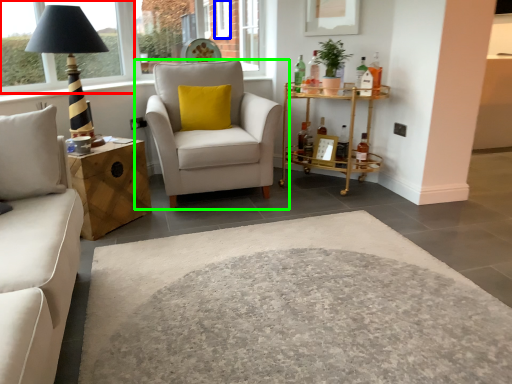
Question: Which object is positioned farthest from window frame (highlighted by a red box)? Select from window (highlighted by a blue box) and chair (highlighted by a green box).

Choices:
 (A) window
 (B) chair

Answer: (A)